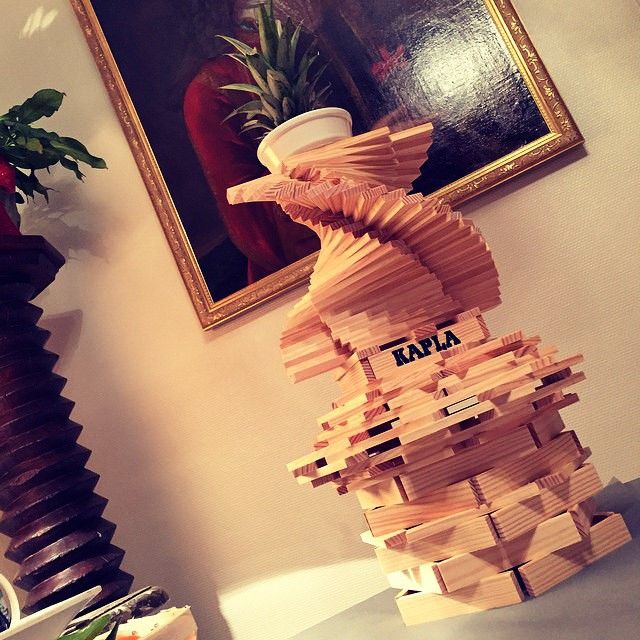
Find the location of `oil painting`. oil painting is located at coordinates (296, 61).